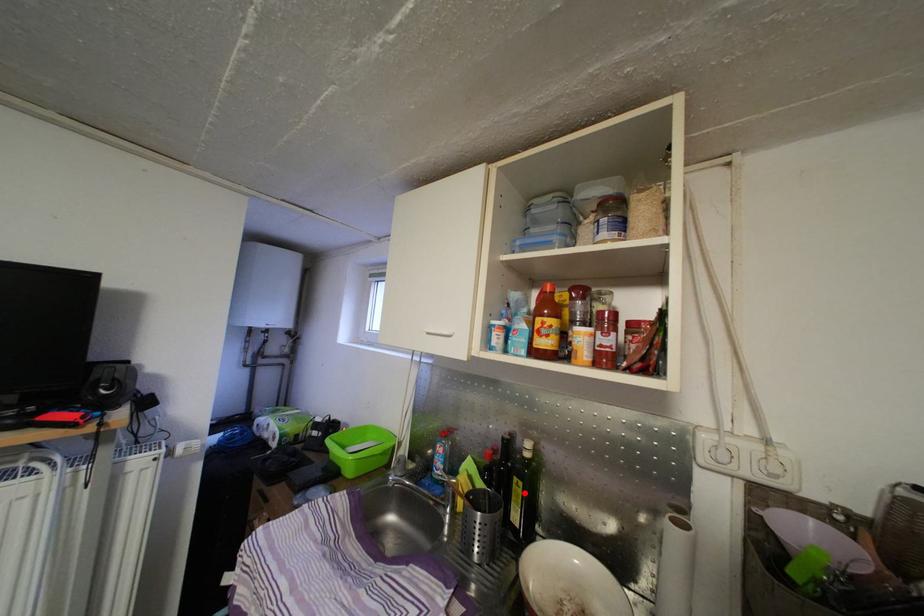
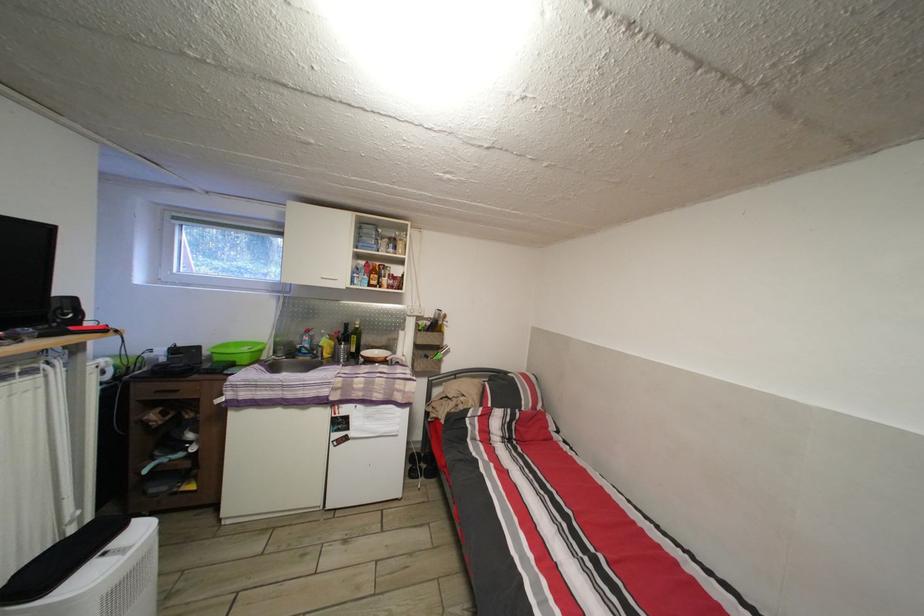
Locate, in the second image, the point that corresponds to the highlighted location in the first image.

(360, 345)